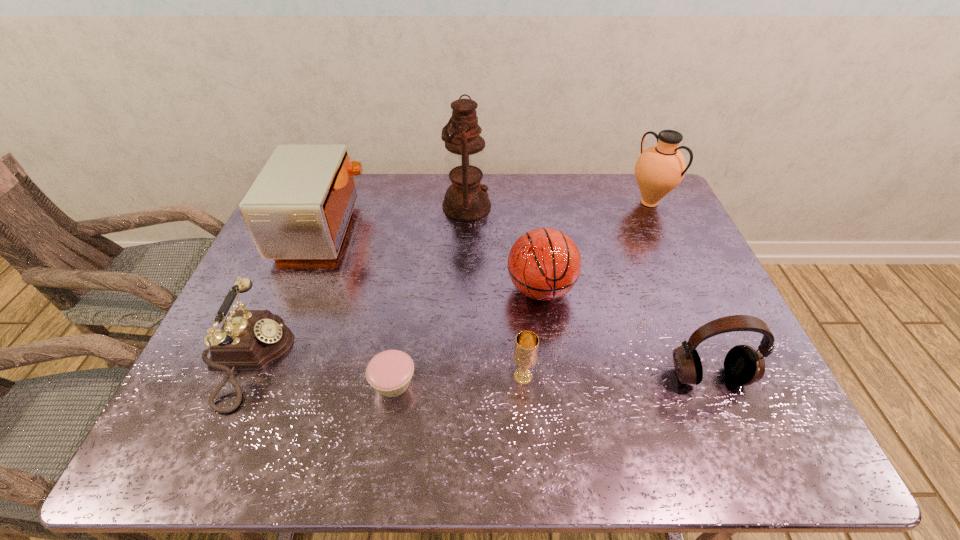
Where is `free spot between the pitcher and the headset`? free spot between the pitcher and the headset is located at coordinates (679, 289).

Locate an element on the screen. Image resolution: width=960 pixels, height=540 pixels. vacant region between the headset and the cupcake is located at coordinates (551, 379).

The image size is (960, 540). Find the location of `vacant area that lies between the chalice and the cupcake`. vacant area that lies between the chalice and the cupcake is located at coordinates (458, 380).

Where is `unoccupied area between the basketball and the headset`? This screenshot has height=540, width=960. unoccupied area between the basketball and the headset is located at coordinates (625, 333).

Where is `free space that is in between the telephone and the oil lamp`? This screenshot has width=960, height=540. free space that is in between the telephone and the oil lamp is located at coordinates (358, 282).

You are a GUI agent. You are given a task and a screenshot of the screen. Output one action in this format:
    pyautogui.click(x=<x>, y=<y>)
    Task: Click on the empty location between the headset and the sixth object from right to left
    The height and width of the screenshot is (540, 960).
    Given the screenshot: What is the action you would take?
    pyautogui.click(x=551, y=379)

The image size is (960, 540). I want to click on free spot between the toaster oven and the chalice, so click(423, 302).

The image size is (960, 540). Identify the location of empty location between the cupcake and the headset. (551, 379).

At what (x,y) coordinates should I click in order to perform the action: click on free space between the toaster oven and the sixth object from right to left. Please return your answer as a coordinate pair (x, y). Looking at the image, I should click on (358, 305).

Select which object appears as the third closest to the chalice. Please provide its 2D coordinates. Your answer should be formatted as a tuple, i.e. [(x, y)], where the tuple contains the x and y coordinates of a point satisfying the conditions above.

[(743, 365)]